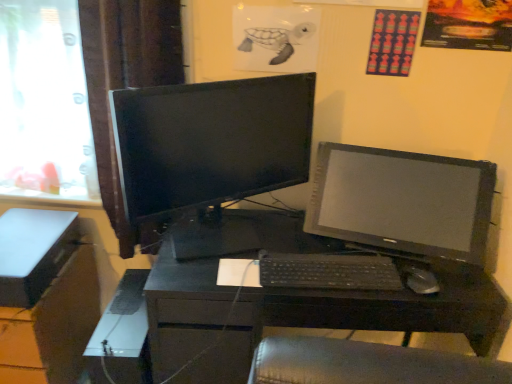
You are a GUI agent. You are given a task and a screenshot of the screen. Output one action in this format:
    pyautogui.click(x=<x>, y=<y>)
    Task: Click on the free location to the right of black plastic mouse at center
    The height and width of the screenshot is (384, 512).
    Given the screenshot: What is the action you would take?
    pyautogui.click(x=449, y=281)